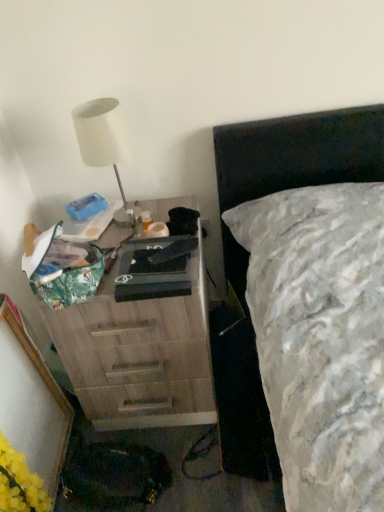
Question: From a real-world perspective, relative to wooden chest of drawers at left, is white matte lamp at upper left vertically above or below?

Choices:
 (A) above
 (B) below

Answer: (A)

Question: Is white matte lamp at upper left to the left or to the right of wooden chest of drawers at left in the image?

Choices:
 (A) right
 (B) left

Answer: (B)

Question: Considering the real-world distances, which object is closest to the wooden chest of drawers at left?

Choices:
 (A) white matte lamp at upper left
 (B) yellow matte flower at lower left

Answer: (B)

Question: Which object is positioned closest to the yellow matte flower at lower left?

Choices:
 (A) white matte lamp at upper left
 (B) wooden chest of drawers at left

Answer: (B)